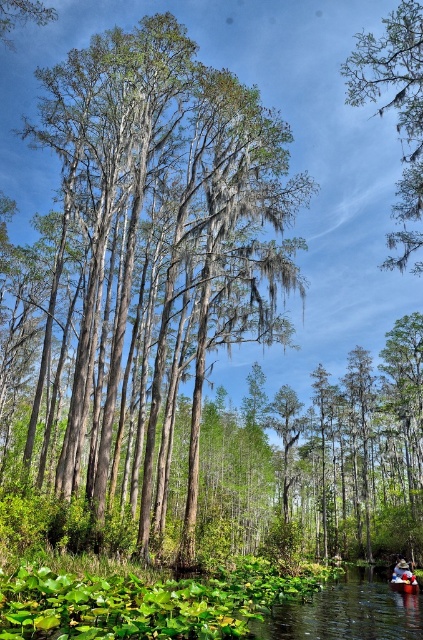
Does smooth bark tree at center come behind green mossy branch at upper right?

That is True.

What do you see at coordinates (153, 253) in the screenshot? I see `smooth bark tree at center` at bounding box center [153, 253].

Does point (184, 38) come behind point (409, 147)?

That is False.

Where is `smooth bark tree at center`? The width and height of the screenshot is (423, 640). smooth bark tree at center is located at coordinates (153, 253).

What do you see at coordinates (395, 109) in the screenshot?
I see `green mossy branch at upper right` at bounding box center [395, 109].

Is point (359, 93) positioned before point (409, 580)?

Yes, point (359, 93) is closer to viewer.

What are the coordinates of `green mossy branch at upper right` in the screenshot? It's located at (395, 109).

Who is higher up, smooth bark tree at center or wooden canoe at center?

smooth bark tree at center is above.

Between smooth bark tree at center and wooden canoe at center, which one appears on the right side from the viewer's perspective?

Positioned to the right is wooden canoe at center.

Does point (269, 173) come in front of point (414, 592)?

No, (269, 173) is further to viewer.

What are the coordinates of `smooth bark tree at center` in the screenshot? It's located at (153, 253).